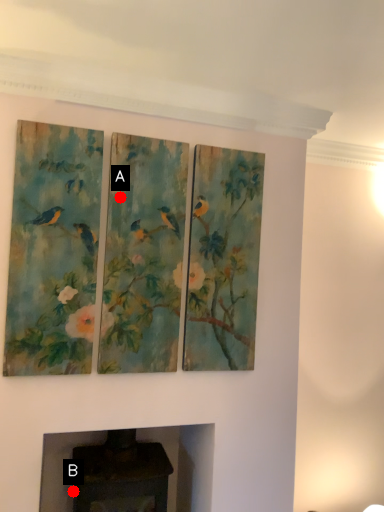
Question: Two points are circled on the image, labeled by A and B beside each circle. Which point is farther to the camera?

Choices:
 (A) A is further
 (B) B is further

Answer: (B)